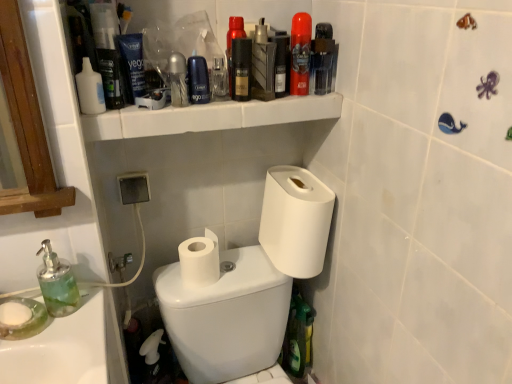
You are a GUI agent. You are given a task and a screenshot of the screen. Output one action in this format:
    pyautogui.click(x=<x>, y=<y>)
    Task: Click on the vacant space situated above green glass soap dispenser at lower left (from a real-world perspective)
    
    Given the screenshot: What is the action you would take?
    coord(57,333)